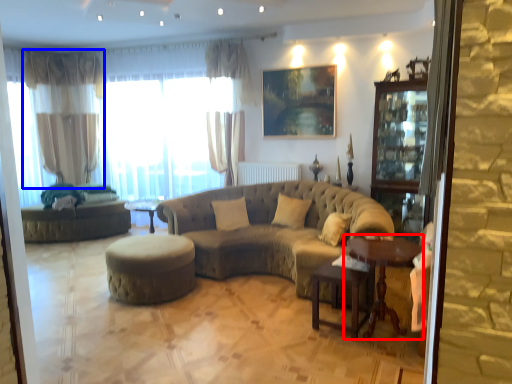
Question: Which point is further to the camera, table (highlighted by a red box) or curtain (highlighted by a blue box)?

Choices:
 (A) table
 (B) curtain

Answer: (B)